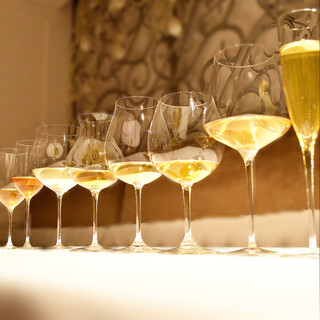
The image size is (320, 320). Identify the location of 5 wine glasses on the right. (300, 77), (240, 92), (182, 130), (136, 130), (96, 143).